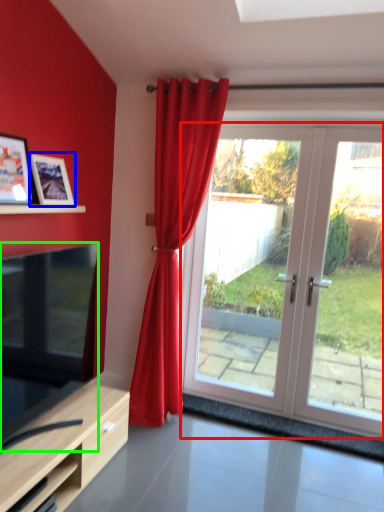
Question: Which is farther away from door (highlighted by a red box)? picture frame (highlighted by a blue box) or television (highlighted by a green box)?

Choices:
 (A) picture frame
 (B) television

Answer: (A)